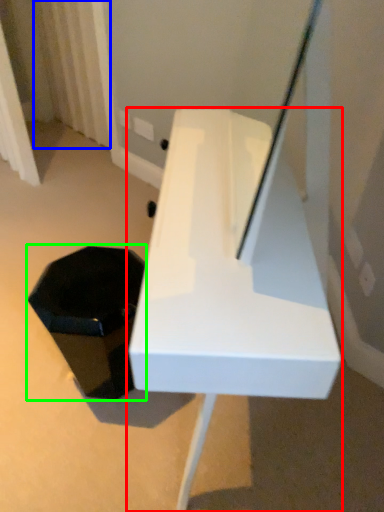
Question: Considering the real-world distances, which object is closest to furniture (highlighted by a red box)? curtain (highlighted by a blue box) or storage box (highlighted by a green box).

Choices:
 (A) curtain
 (B) storage box

Answer: (B)